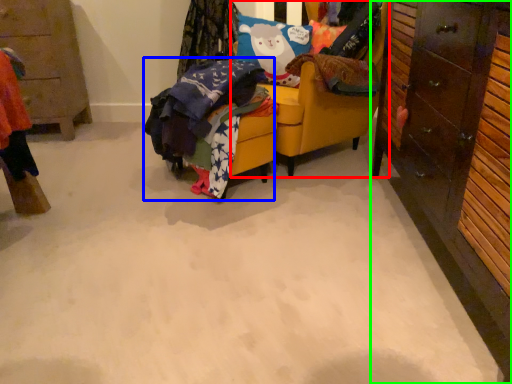
Question: Which object is positioned closest to chair (highlighted by a red box)? Select from clothing (highlighted by a blue box) and cabinetry (highlighted by a green box).

Choices:
 (A) clothing
 (B) cabinetry

Answer: (A)